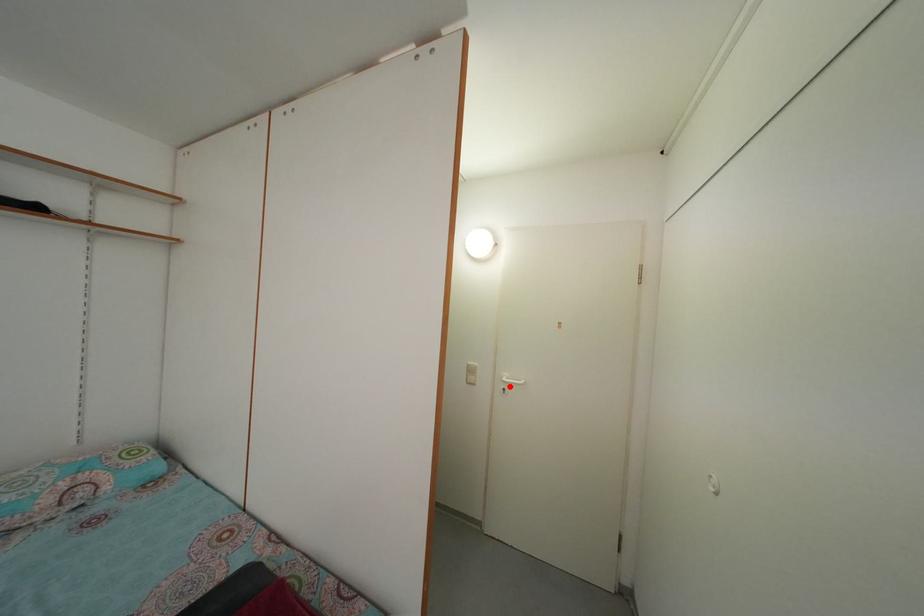
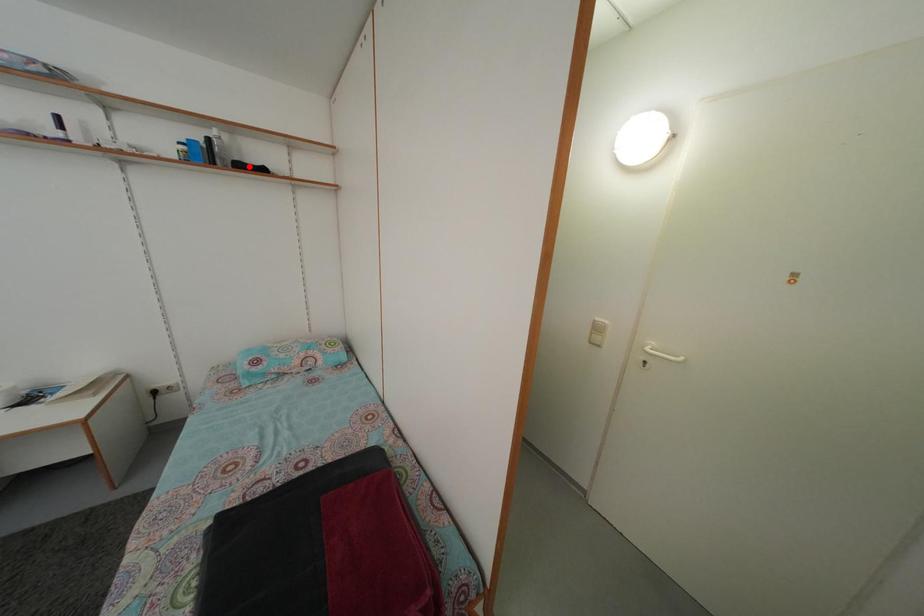
I am providing you with two images of the same scene from different viewpoints. A red point is marked on the first image and another point is marked on the second image. Are the points marked in image1 and image2 representing the same 3D position?

No